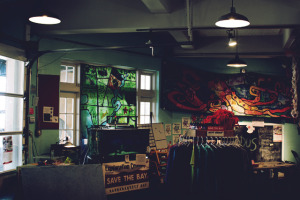
Image resolution: width=300 pixels, height=200 pixels. What are the coordinates of `clothes rack` in the screenshot? It's located at (205, 140).